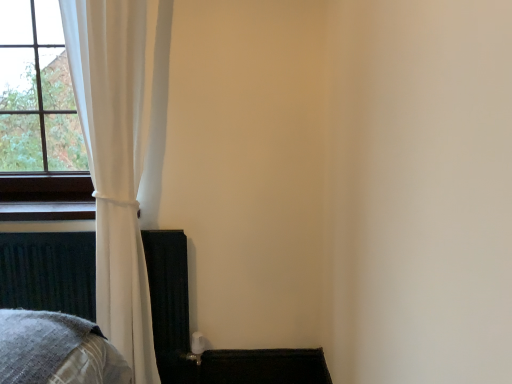
Locate an element on the screen. This screenshot has height=384, width=512. metallic dark gray bed frame at lower left is located at coordinates (48, 272).

What is the approximate height of metallic dark gray bed frame at lower left?

It is 24.63 inches.

The image size is (512, 384). What do you see at coordinates (48, 272) in the screenshot? I see `metallic dark gray bed frame at lower left` at bounding box center [48, 272].

Image resolution: width=512 pixels, height=384 pixels. Describe the element at coordinates (114, 164) in the screenshot. I see `white fabric curtain at left` at that location.

What is the approximate width of white fabric curtain at left?

7.04 inches.

Where is `white fabric curtain at left`? The image size is (512, 384). white fabric curtain at left is located at coordinates (114, 164).

Locate an element on the screen. The width and height of the screenshot is (512, 384). metallic dark gray bed frame at lower left is located at coordinates (48, 272).

Does white fabric curtain at left appear on the right side of metallic dark gray bed frame at lower left?

Indeed, white fabric curtain at left is positioned on the right side of metallic dark gray bed frame at lower left.

Which object is further away from the camera taking this photo, white fabric curtain at left or metallic dark gray bed frame at lower left?

metallic dark gray bed frame at lower left is behind.

Does point (116, 48) appear closer or farther from the camera than point (156, 345)?

Clearly, point (116, 48) is closer to the camera than point (156, 345).

From the image's perspective, between white fabric curtain at left and metallic dark gray bed frame at lower left, which one is located above?

white fabric curtain at left, from the image's perspective.

From a real-world perspective, between white fabric curtain at left and metallic dark gray bed frame at lower left, who is vertically higher?

white fabric curtain at left.

Considering the sizes of white fabric curtain at left and metallic dark gray bed frame at lower left in the image, is white fabric curtain at left wider or thinner than metallic dark gray bed frame at lower left?

Considering their sizes, white fabric curtain at left looks broader than metallic dark gray bed frame at lower left.

Considering the sizes of objects white fabric curtain at left and metallic dark gray bed frame at lower left in the image provided, who is shorter, white fabric curtain at left or metallic dark gray bed frame at lower left?

With less height is metallic dark gray bed frame at lower left.

Which of these two, white fabric curtain at left or metallic dark gray bed frame at lower left, is smaller?

metallic dark gray bed frame at lower left.

Would you say white fabric curtain at left contains metallic dark gray bed frame at lower left?

Yes, metallic dark gray bed frame at lower left is a part of white fabric curtain at left.

Is white fabric curtain at left far away from metallic dark gray bed frame at lower left?

No, white fabric curtain at left is not far away from metallic dark gray bed frame at lower left.

Is white fabric curtain at left turned away from metallic dark gray bed frame at lower left?

Yes, white fabric curtain at left is positioned with its back facing metallic dark gray bed frame at lower left.

How different are the orientations of white fabric curtain at left and metallic dark gray bed frame at lower left in degrees?

The angle between the facing direction of white fabric curtain at left and the facing direction of metallic dark gray bed frame at lower left is 0.325 degrees.

What are the coordinates of `bed frame on the left of white fabric curtain at left` in the screenshot? It's located at (48, 272).

Visually, is metallic dark gray bed frame at lower left positioned to the left or to the right of white fabric curtain at left?

In the image, metallic dark gray bed frame at lower left appears on the left side of white fabric curtain at left.

Is metallic dark gray bed frame at lower left positioned behind white fabric curtain at left?

Yes, the depth of metallic dark gray bed frame at lower left is greater than that of white fabric curtain at left.

Considering the points (88, 309) and (104, 264), which point is in front, point (88, 309) or point (104, 264)?

The point (104, 264) is in front.

From the image's perspective, is metallic dark gray bed frame at lower left above or below white fabric curtain at left?

metallic dark gray bed frame at lower left is situated lower than white fabric curtain at left in the image.

From a real-world perspective, which object rests below the other?

metallic dark gray bed frame at lower left, from a real-world perspective.

Can you confirm if metallic dark gray bed frame at lower left is thinner than white fabric curtain at left?

Yes.

Can you confirm if metallic dark gray bed frame at lower left is taller than white fabric curtain at left?

No, metallic dark gray bed frame at lower left is not taller than white fabric curtain at left.

Can you confirm if metallic dark gray bed frame at lower left is smaller than white fabric curtain at left?

Correct, metallic dark gray bed frame at lower left occupies less space than white fabric curtain at left.

In the scene shown: Can we say metallic dark gray bed frame at lower left lies outside white fabric curtain at left?

No, metallic dark gray bed frame at lower left is not outside of white fabric curtain at left.

Is metallic dark gray bed frame at lower left far away from white fabric curtain at left?

No, metallic dark gray bed frame at lower left is not far from white fabric curtain at left.

Could you tell me if metallic dark gray bed frame at lower left is turned towards white fabric curtain at left?

Yes.

Can you tell me how much metallic dark gray bed frame at lower left and white fabric curtain at left differ in facing direction?

The angle between the facing direction of metallic dark gray bed frame at lower left and the facing direction of white fabric curtain at left is 0.325 degrees.

Locate an element on the screen. The image size is (512, 384). curtain that appears in front of the metallic dark gray bed frame at lower left is located at coordinates (114, 164).

This screenshot has width=512, height=384. I want to click on curtain above the metallic dark gray bed frame at lower left (from a real-world perspective), so click(x=114, y=164).

Identify the location of bed frame lying behind the white fabric curtain at left. This screenshot has width=512, height=384. (48, 272).